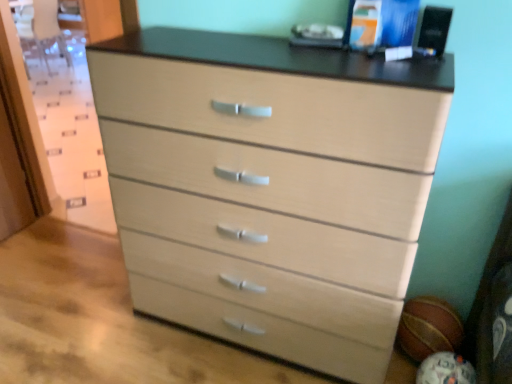
This screenshot has height=384, width=512. In order to click on free region on the left part of light wood/texture chest of drawers at center in this screenshot , I will do `click(96, 318)`.